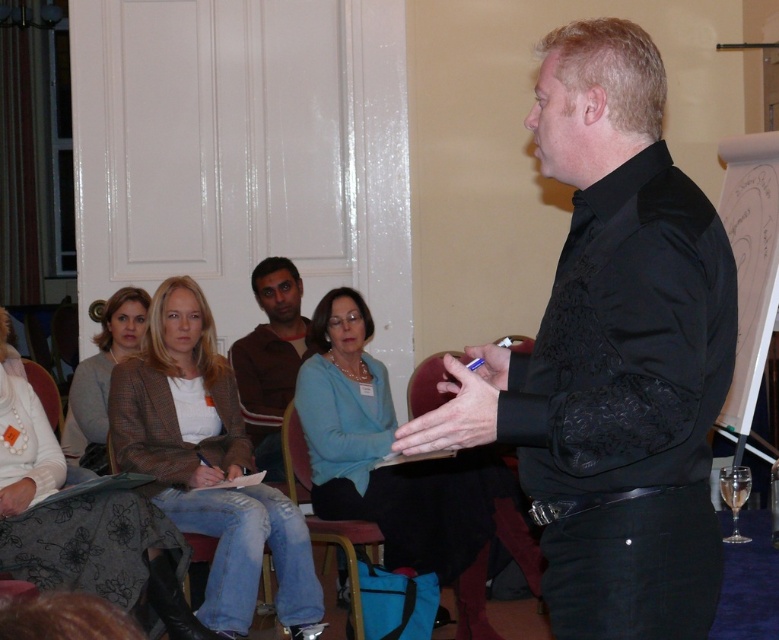
Question: Does black satin shirt at center appear on the right side of matte brown jacket at center?

Choices:
 (A) no
 (B) yes

Answer: (B)

Question: Which object is positioned closest to the matte brown jacket at center?

Choices:
 (A) blue fabric skirt at center
 (B) brown leather chair at lower center
 (C) matte brown blazer at center
 (D) denim jeans at center

Answer: (D)

Question: Is denim jeans at center in front of matte brown blazer at center?

Choices:
 (A) no
 (B) yes

Answer: (B)

Question: Which object is farther from the camera taking this photo?

Choices:
 (A) denim jeans at center
 (B) black satin shirt at center
 (C) matte brown blazer at center

Answer: (C)

Question: Which point is farther to the camera?

Choices:
 (A) denim jeans at center
 (B) black satin shirt at center
 (C) matte brown blazer at center

Answer: (C)

Question: Is brown sweater at center to the right of matte brown blazer at center from the viewer's perspective?

Choices:
 (A) no
 (B) yes

Answer: (B)